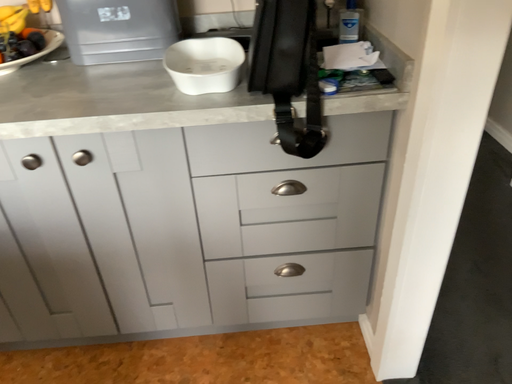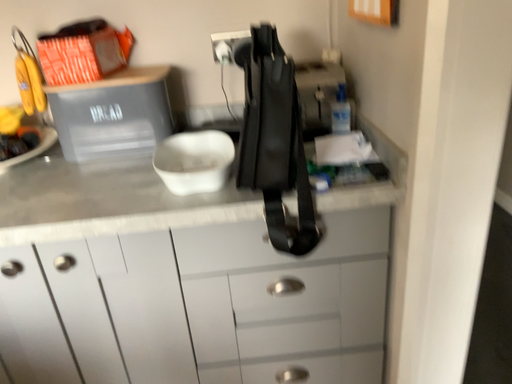
Question: Which way did the camera rotate in the video?

Choices:
 (A) rotated downward
 (B) rotated upward

Answer: (B)